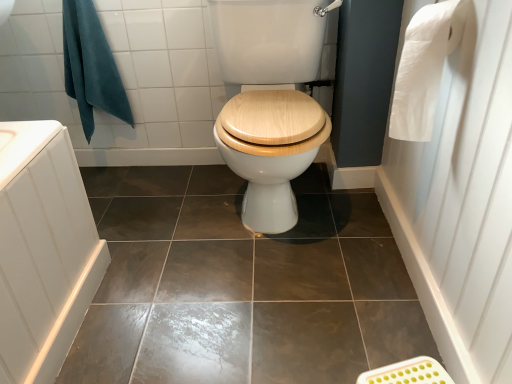
Question: Would you say white paper at upper right is inside or outside teal fabric towel at upper left?

Choices:
 (A) outside
 (B) inside

Answer: (A)

Question: Is white paper at upper right bigger or smaller than teal fabric towel at upper left?

Choices:
 (A) big
 (B) small

Answer: (B)

Question: Which of these objects is positioned closest to the white paper at upper right?

Choices:
 (A) brown glossy tile at center
 (B) white paper towel at right
 (C) teal fabric towel at upper left

Answer: (B)

Question: Which is nearer to the white paper towel at right?

Choices:
 (A) teal fabric towel at upper left
 (B) white paper at upper right
 (C) brown glossy tile at center

Answer: (B)